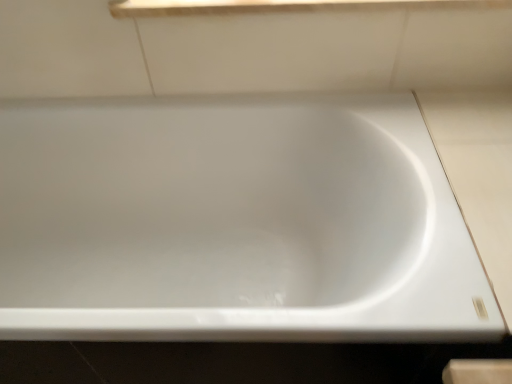
Question: Is the depth of white glossy window sill at upper center less than that of white glossy bathtub at center?

Choices:
 (A) no
 (B) yes

Answer: (A)

Question: Does white glossy window sill at upper center have a smaller size compared to white glossy bathtub at center?

Choices:
 (A) no
 (B) yes

Answer: (B)

Question: From the image's perspective, does white glossy window sill at upper center appear higher than white glossy bathtub at center?

Choices:
 (A) no
 (B) yes

Answer: (B)

Question: Can you confirm if white glossy window sill at upper center is thinner than white glossy bathtub at center?

Choices:
 (A) yes
 (B) no

Answer: (A)

Question: Can you confirm if white glossy window sill at upper center is wider than white glossy bathtub at center?

Choices:
 (A) no
 (B) yes

Answer: (A)

Question: Considering the relative sizes of white glossy window sill at upper center and white glossy bathtub at center in the image provided, is white glossy window sill at upper center shorter than white glossy bathtub at center?

Choices:
 (A) no
 (B) yes

Answer: (B)

Question: From the image's perspective, is white glossy bathtub at center beneath white glossy window sill at upper center?

Choices:
 (A) no
 (B) yes

Answer: (B)

Question: Is white glossy bathtub at center not within white glossy window sill at upper center?

Choices:
 (A) no
 (B) yes

Answer: (B)

Question: Can you confirm if white glossy bathtub at center is shorter than white glossy window sill at upper center?

Choices:
 (A) yes
 (B) no

Answer: (B)

Question: Is white glossy bathtub at center to the right of white glossy window sill at upper center from the viewer's perspective?

Choices:
 (A) no
 (B) yes

Answer: (A)

Question: Is white glossy bathtub at center facing away from white glossy window sill at upper center?

Choices:
 (A) no
 (B) yes

Answer: (A)

Question: From the image's perspective, is white glossy bathtub at center above white glossy window sill at upper center?

Choices:
 (A) yes
 (B) no

Answer: (B)

Question: Is white glossy window sill at upper center in front of or behind white glossy bathtub at center in the image?

Choices:
 (A) behind
 (B) front

Answer: (A)